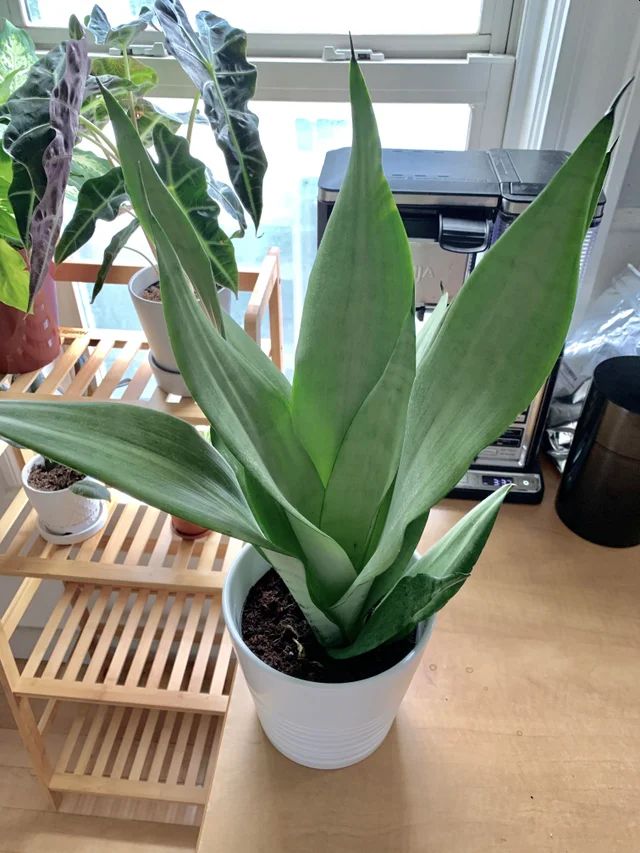
Locate an element on the screen. The image size is (640, 853). brown table is located at coordinates (413, 816).